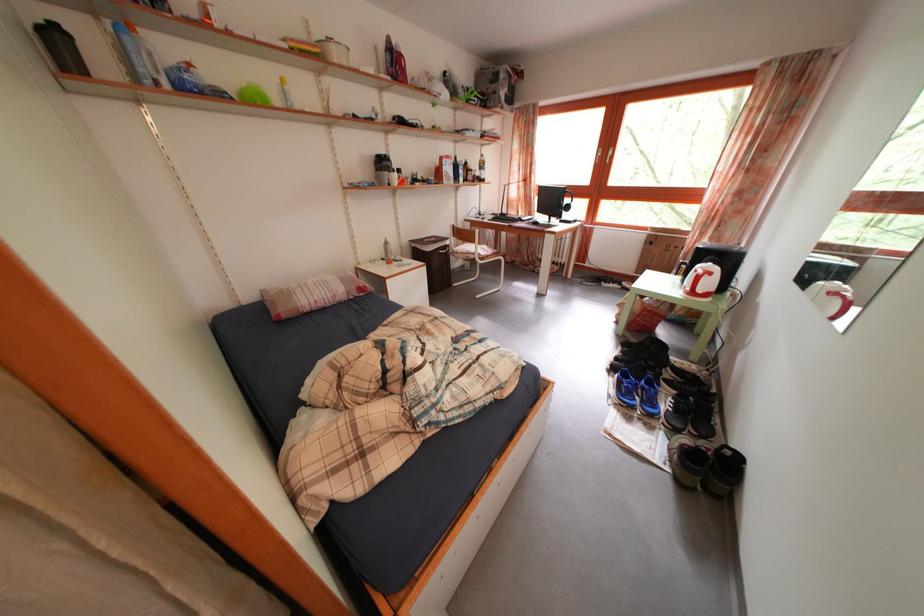
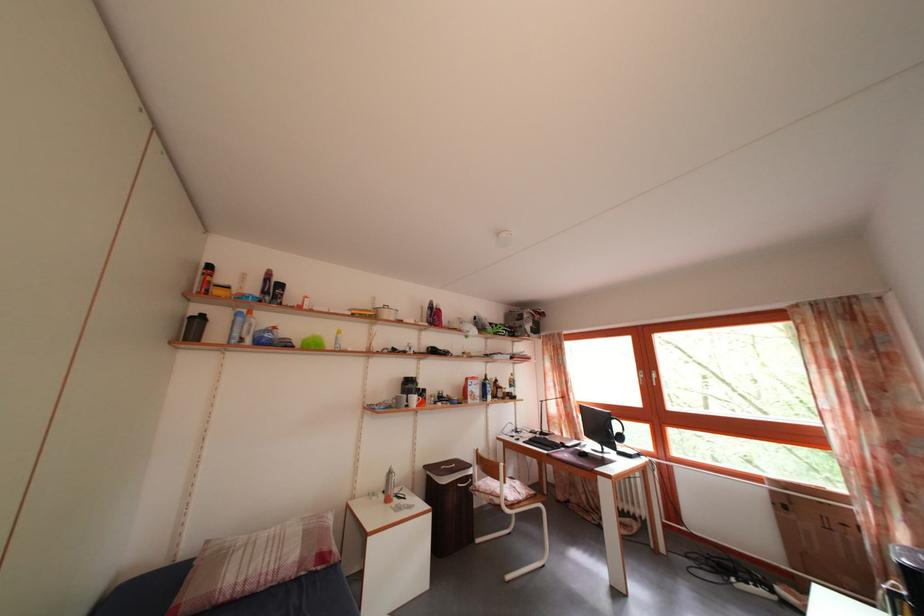
In the second image, find the point that corresponds to point (445, 246) in the first image.

(468, 472)